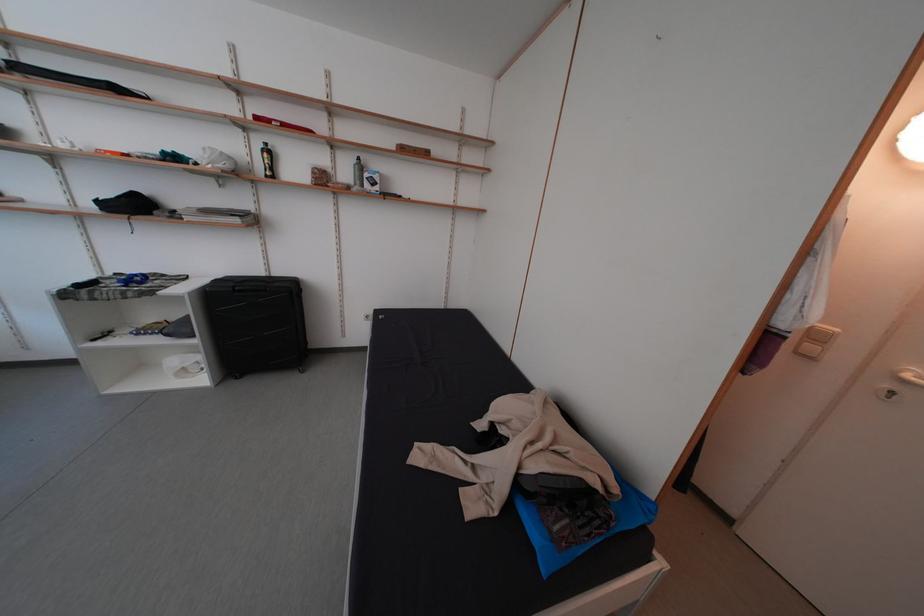
This screenshot has height=616, width=924. What are the coordinates of `black spray bottle` in the screenshot? It's located at (266, 161).